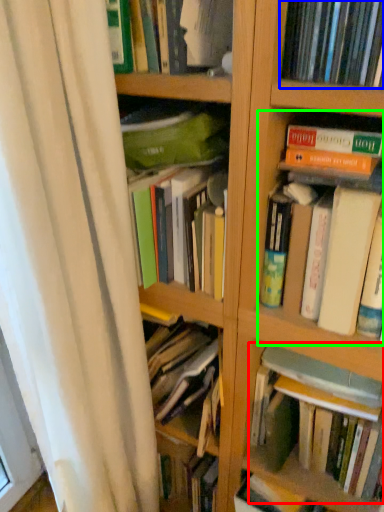
Question: Which object is positioned farthest from book (highlighted by a red box)? Select from book (highlighted by a blue box) and book (highlighted by a green box).

Choices:
 (A) book
 (B) book

Answer: (A)